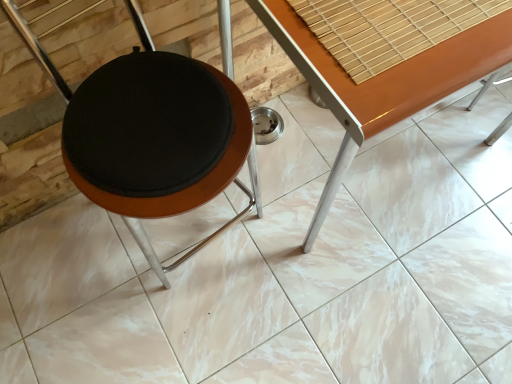
Where is `free space between matte black stool at center and wooden glossy table at center`? This screenshot has height=384, width=512. free space between matte black stool at center and wooden glossy table at center is located at coordinates (254, 286).